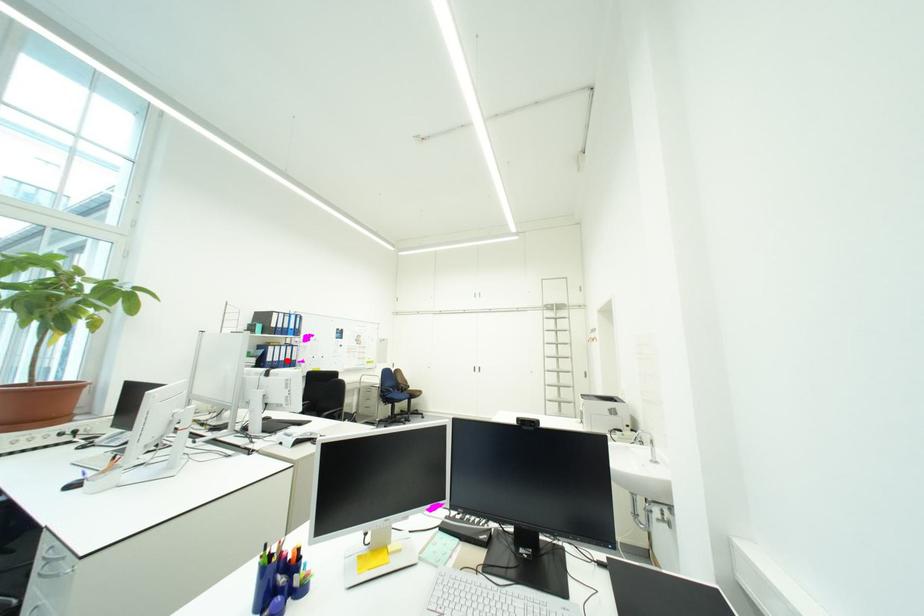
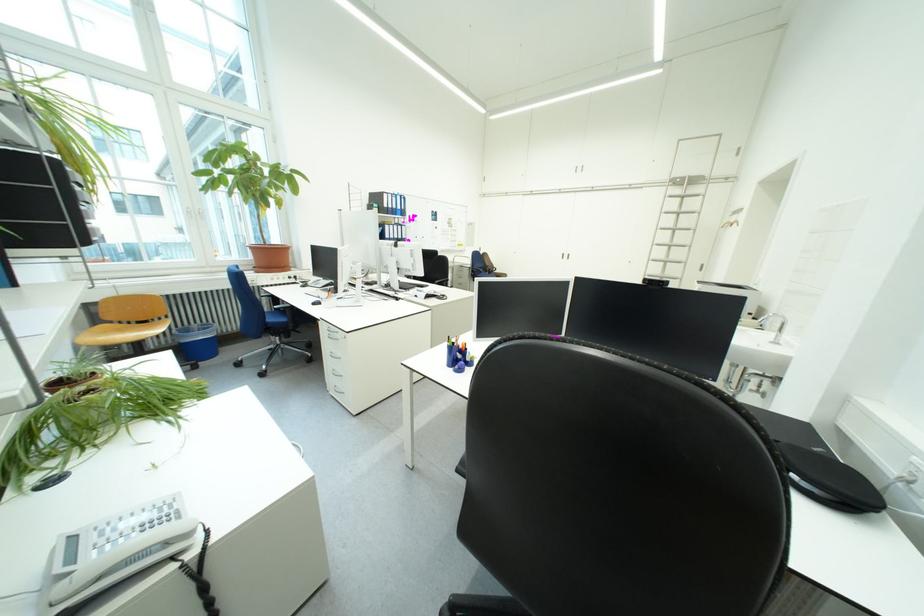
Locate, in the second image, the point that corresponds to the highlighted location in the first image.

(403, 238)